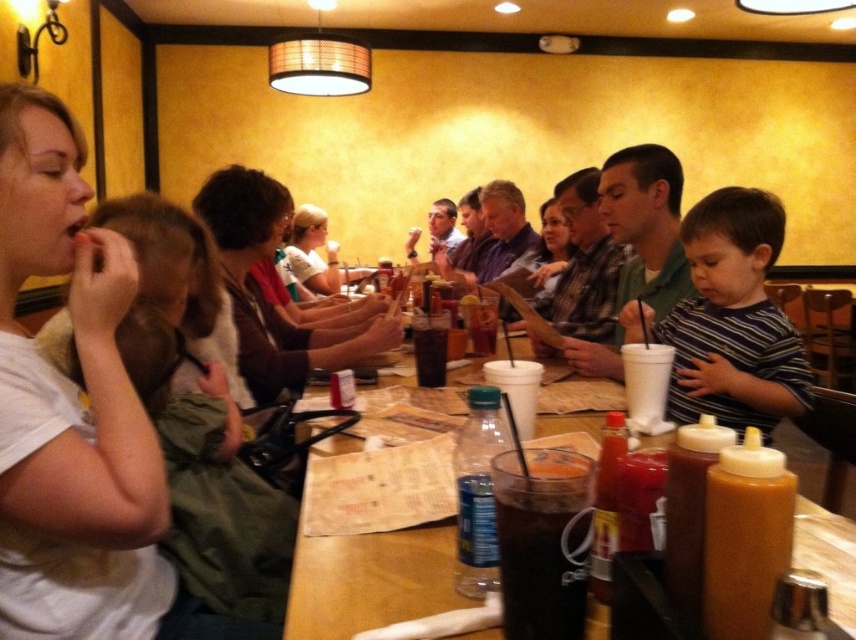
Question: Does white matte shirt at upper left have a lesser width compared to wooden table at center?

Choices:
 (A) no
 (B) yes

Answer: (A)

Question: Which of these objects is positioned farthest from the dark brown plastic cup at center?

Choices:
 (A) translucent glass cup at table center
 (B) matte white shirt at center
 (C) matte brown shirt at center

Answer: (B)

Question: Is matte brown shirt at center thinner than dark brown plastic cup at center?

Choices:
 (A) no
 (B) yes

Answer: (A)

Question: Which of these objects is positioned farthest from the matte brown shirt at center?

Choices:
 (A) dark brown plastic cup at center
 (B) wooden table at center
 (C) striped cotton shirt at center

Answer: (A)

Question: Estimate the real-world distances between objects in this image. Which object is farther from the striped cotton shirt at center?

Choices:
 (A) white matte shirt at upper left
 (B) wooden table at center
 (C) dark brown plastic cup at center
 (D) matte brown shirt at center

Answer: (A)

Question: Is white matte shirt at upper left bigger than green plaid shirt at center?

Choices:
 (A) yes
 (B) no

Answer: (B)